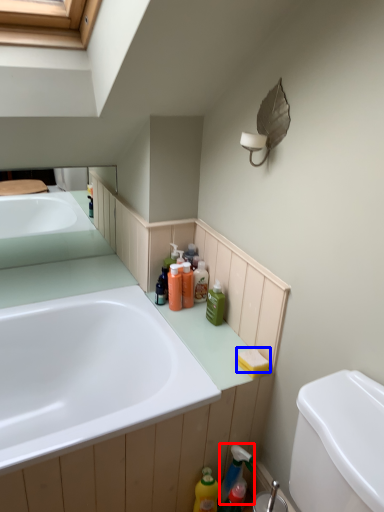
Question: Which object is closer to the camera taking this photo, cleaning product (highlighted by a red box) or soap (highlighted by a blue box)?

Choices:
 (A) cleaning product
 (B) soap

Answer: (B)